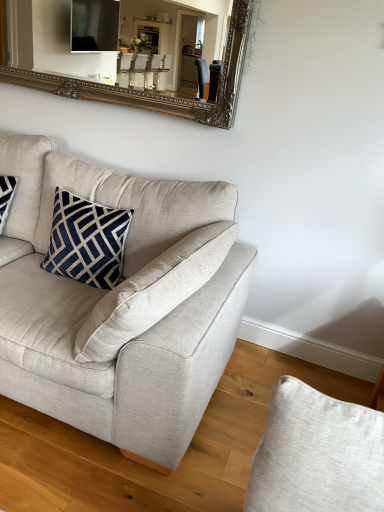
Question: Can you confirm if silver/gilded mirror at upper center is wider than light beige fabric couch at center?

Choices:
 (A) no
 (B) yes

Answer: (A)

Question: Is light beige fabric couch at center completely or partially inside silver/gilded mirror at upper center?

Choices:
 (A) no
 (B) yes

Answer: (A)

Question: Does silver/gilded mirror at upper center appear on the right side of light beige fabric couch at center?

Choices:
 (A) no
 (B) yes

Answer: (B)

Question: Can you confirm if silver/gilded mirror at upper center is taller than light beige fabric couch at center?

Choices:
 (A) no
 (B) yes

Answer: (A)

Question: Can you confirm if silver/gilded mirror at upper center is shorter than light beige fabric couch at center?

Choices:
 (A) no
 (B) yes

Answer: (B)

Question: Is silver/gilded mirror at upper center outside light beige fabric couch at center?

Choices:
 (A) yes
 (B) no

Answer: (A)

Question: From a real-world perspective, is navy blue fabric pillow at upper left over light beige fabric couch at center?

Choices:
 (A) yes
 (B) no

Answer: (A)

Question: Is navy blue fabric pillow at upper left looking in the opposite direction of light beige fabric couch at center?

Choices:
 (A) no
 (B) yes

Answer: (B)

Question: Is light beige fabric couch at center inside navy blue fabric pillow at upper left?

Choices:
 (A) yes
 (B) no

Answer: (B)

Question: Considering the relative sizes of navy blue fabric pillow at upper left and light beige fabric couch at center in the image provided, is navy blue fabric pillow at upper left shorter than light beige fabric couch at center?

Choices:
 (A) no
 (B) yes

Answer: (B)

Question: From the image's perspective, is navy blue fabric pillow at upper left under light beige fabric couch at center?

Choices:
 (A) no
 (B) yes

Answer: (A)

Question: Does navy blue fabric pillow at upper left have a lesser width compared to light beige fabric couch at center?

Choices:
 (A) no
 (B) yes

Answer: (B)

Question: Does silver/gilded mirror at upper center touch navy blue fabric pillow at upper left?

Choices:
 (A) no
 (B) yes

Answer: (A)